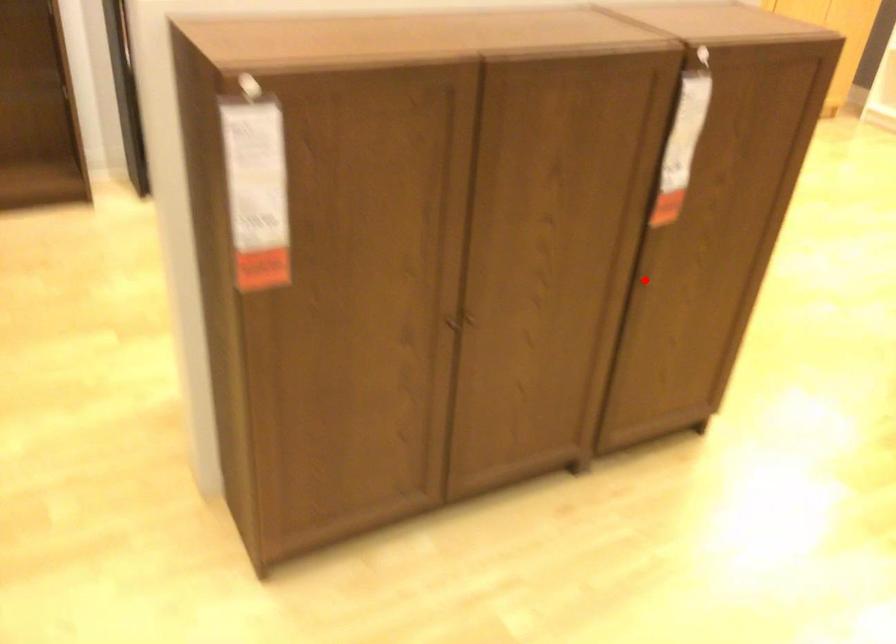
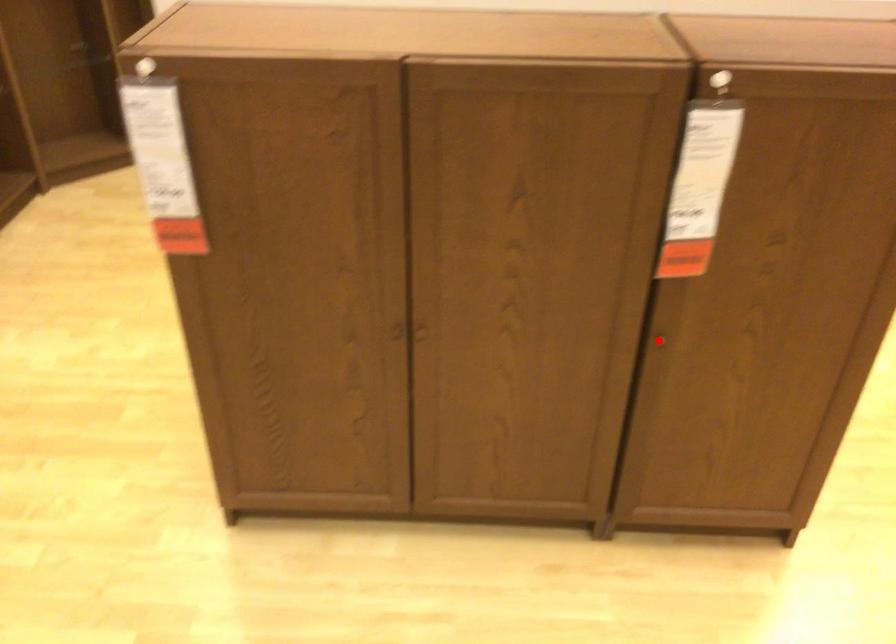
I am providing you with two images of the same scene from different viewpoints. A red point is marked on the first image and another point is marked on the second image. Is the red point in image1 aligned with the point shown in image2?

Yes